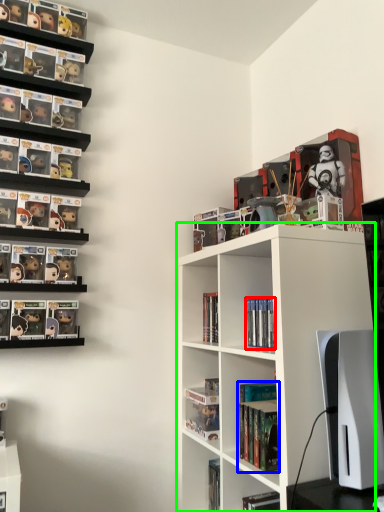
Question: Which object is positioned closest to book (highlighted by a red box)? Select from book (highlighted by a blue box) and shelf (highlighted by a green box).

Choices:
 (A) book
 (B) shelf

Answer: (A)